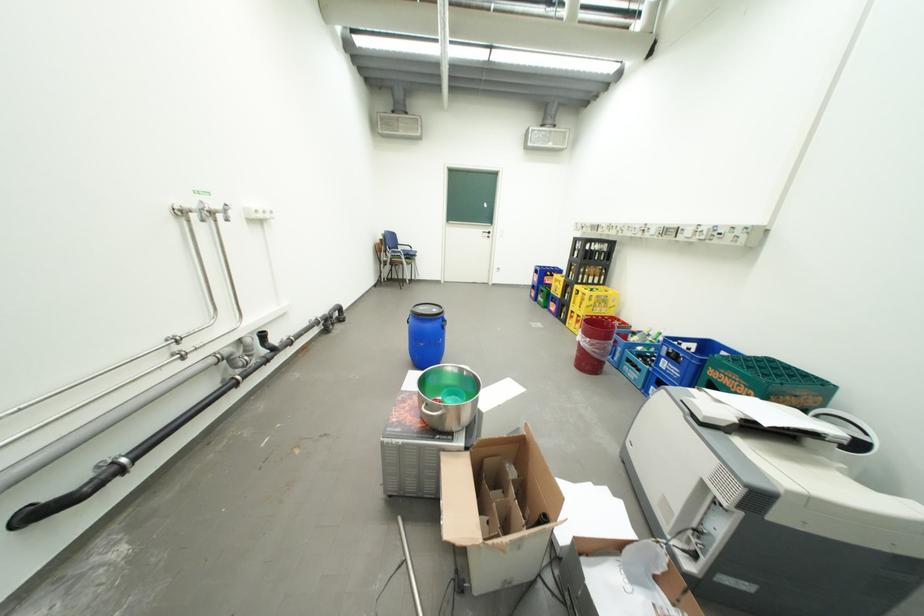
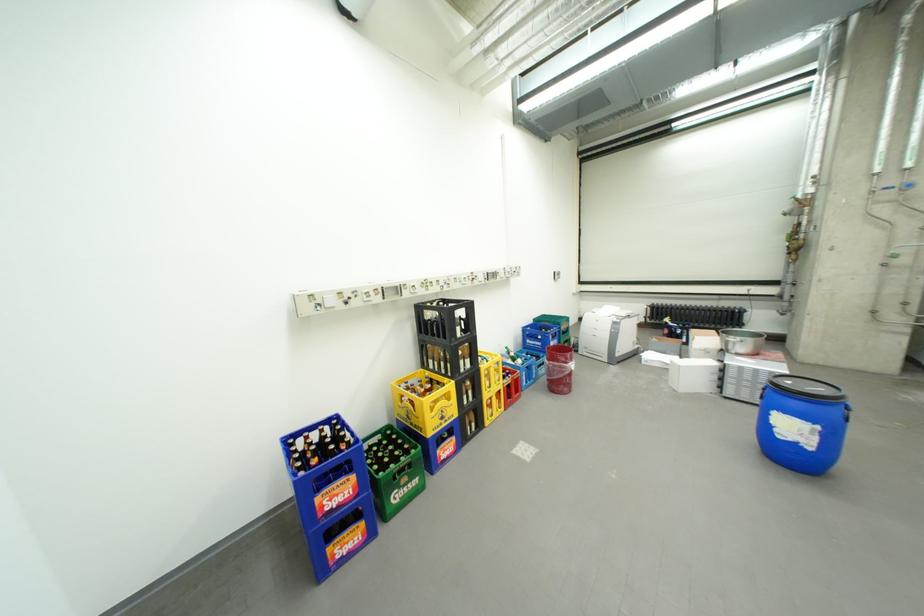
Locate, in the second image, the point that corresponds to (674,361) in the first image.

(562, 344)